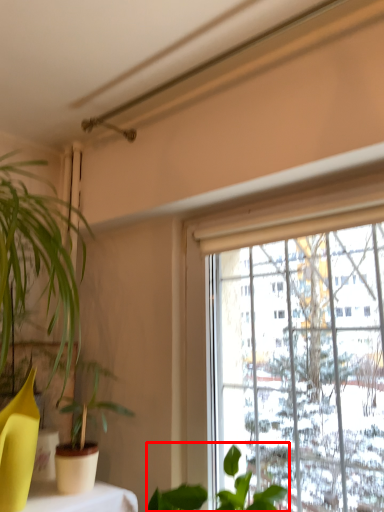
Question: From the image's perspective, where is houseplant (annotated by the red box) located relative to houseplant?

Choices:
 (A) above
 (B) below

Answer: (B)